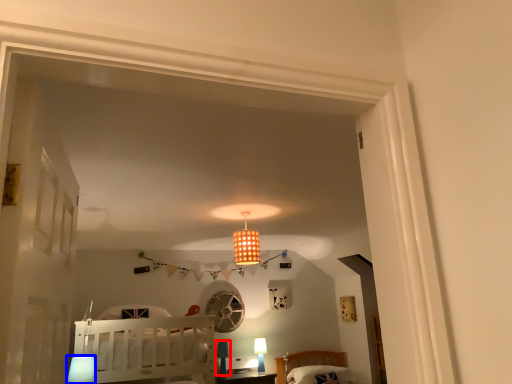
Question: Which object is further to the camera taking this photo, lamp (highlighted by a red box) or lamp (highlighted by a blue box)?

Choices:
 (A) lamp
 (B) lamp

Answer: (A)